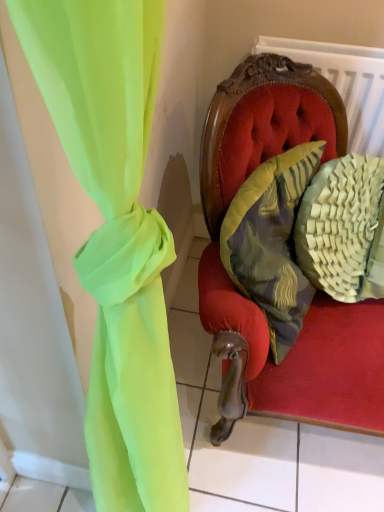
Where is `woven beige pillow at right, which appears as the 1th pillow when viewed from the right`? woven beige pillow at right, which appears as the 1th pillow when viewed from the right is located at coordinates (343, 229).

Describe the element at coordinates (343, 229) in the screenshot. The height and width of the screenshot is (512, 384). I see `woven beige pillow at right, which appears as the 1th pillow when viewed from the right` at that location.

Identify the location of textured yellow pillow at center, the first pillow positioned from the left. The height and width of the screenshot is (512, 384). (271, 242).

Measure the distance between textured yellow pillow at center, the first pillow positioned from the left, and camera.

The depth of textured yellow pillow at center, the first pillow positioned from the left, is 34.22 inches.

This screenshot has width=384, height=512. What do you see at coordinates (271, 242) in the screenshot?
I see `textured yellow pillow at center, placed as the 2th pillow when sorted from right to left` at bounding box center [271, 242].

Where is `woven beige pillow at right, placed as the second pillow when sorted from left to right`? woven beige pillow at right, placed as the second pillow when sorted from left to right is located at coordinates (343, 229).

Is textured yellow pillow at center, the first pillow positioned from the left, to the left of woven beige pillow at right, which appears as the 1th pillow when viewed from the right, from the viewer's perspective?

Yes, textured yellow pillow at center, the first pillow positioned from the left, is to the left of woven beige pillow at right, which appears as the 1th pillow when viewed from the right.

Considering the positions of objects textured yellow pillow at center, the first pillow positioned from the left, and woven beige pillow at right, which appears as the 1th pillow when viewed from the right, in the image provided, who is in front, textured yellow pillow at center, the first pillow positioned from the left, or woven beige pillow at right, which appears as the 1th pillow when viewed from the right,?

textured yellow pillow at center, the first pillow positioned from the left, is closer to the camera.

Is point (271, 198) positioned behind point (310, 215)?

That is False.

From the image's perspective, which object appears higher, textured yellow pillow at center, the first pillow positioned from the left, or woven beige pillow at right, which appears as the 1th pillow when viewed from the right?

From the image's view, woven beige pillow at right, which appears as the 1th pillow when viewed from the right, is above.

From a real-world perspective, which object stands above the other?

textured yellow pillow at center, placed as the 2th pillow when sorted from right to left, from a real-world perspective.

Considering the relative sizes of textured yellow pillow at center, placed as the 2th pillow when sorted from right to left, and woven beige pillow at right, placed as the second pillow when sorted from left to right, in the image provided, is textured yellow pillow at center, placed as the 2th pillow when sorted from right to left, wider than woven beige pillow at right, placed as the second pillow when sorted from left to right,?

No.

From the picture: Between textured yellow pillow at center, the first pillow positioned from the left, and woven beige pillow at right, placed as the second pillow when sorted from left to right, which one has more height?

Standing taller between the two is woven beige pillow at right, placed as the second pillow when sorted from left to right.

Between textured yellow pillow at center, placed as the 2th pillow when sorted from right to left, and woven beige pillow at right, which appears as the 1th pillow when viewed from the right, which one has larger size?

textured yellow pillow at center, placed as the 2th pillow when sorted from right to left.

Is textured yellow pillow at center, the first pillow positioned from the left, positioned beyond the bounds of woven beige pillow at right, which appears as the 1th pillow when viewed from the right?

That's correct, textured yellow pillow at center, the first pillow positioned from the left, is outside of woven beige pillow at right, which appears as the 1th pillow when viewed from the right.

Would you say textured yellow pillow at center, the first pillow positioned from the left, is a long distance from woven beige pillow at right, placed as the second pillow when sorted from left to right?

That's not correct — textured yellow pillow at center, the first pillow positioned from the left, is a little close to woven beige pillow at right, placed as the second pillow when sorted from left to right.

Could you tell me if textured yellow pillow at center, placed as the 2th pillow when sorted from right to left, is turned towards woven beige pillow at right, which appears as the 1th pillow when viewed from the right?

Yes, textured yellow pillow at center, placed as the 2th pillow when sorted from right to left, is facing woven beige pillow at right, which appears as the 1th pillow when viewed from the right.

Measure the distance from textured yellow pillow at center, placed as the 2th pillow when sorted from right to left, to woven beige pillow at right, which appears as the 1th pillow when viewed from the right.

textured yellow pillow at center, placed as the 2th pillow when sorted from right to left, and woven beige pillow at right, which appears as the 1th pillow when viewed from the right, are 5.22 inches apart from each other.

Identify the location of pillow in front of the woven beige pillow at right, placed as the second pillow when sorted from left to right. This screenshot has height=512, width=384. (271, 242).

Does woven beige pillow at right, placed as the second pillow when sorted from left to right, appear on the left side of textured yellow pillow at center, the first pillow positioned from the left?

Incorrect, woven beige pillow at right, placed as the second pillow when sorted from left to right, is not on the left side of textured yellow pillow at center, the first pillow positioned from the left.

Is the depth of woven beige pillow at right, placed as the second pillow when sorted from left to right, less than that of textured yellow pillow at center, placed as the 2th pillow when sorted from right to left?

No.

Considering the positions of point (372, 166) and point (257, 226), is point (372, 166) closer or farther from the camera than point (257, 226)?

Clearly, point (372, 166) is more distant from the camera than point (257, 226).

From the image's perspective, which is above, woven beige pillow at right, placed as the second pillow when sorted from left to right, or textured yellow pillow at center, the first pillow positioned from the left?

woven beige pillow at right, placed as the second pillow when sorted from left to right, is shown above in the image.

From a real-world perspective, between woven beige pillow at right, which appears as the 1th pillow when viewed from the right, and textured yellow pillow at center, the first pillow positioned from the left, who is vertically higher?

textured yellow pillow at center, the first pillow positioned from the left.

Considering the relative sizes of woven beige pillow at right, which appears as the 1th pillow when viewed from the right, and textured yellow pillow at center, placed as the 2th pillow when sorted from right to left, in the image provided, is woven beige pillow at right, which appears as the 1th pillow when viewed from the right, thinner than textured yellow pillow at center, placed as the 2th pillow when sorted from right to left,?

In fact, woven beige pillow at right, which appears as the 1th pillow when viewed from the right, might be wider than textured yellow pillow at center, placed as the 2th pillow when sorted from right to left.

Is woven beige pillow at right, which appears as the 1th pillow when viewed from the right, shorter than textured yellow pillow at center, the first pillow positioned from the left?

No.

Can you confirm if woven beige pillow at right, which appears as the 1th pillow when viewed from the right, is smaller than textured yellow pillow at center, placed as the 2th pillow when sorted from right to left?

Indeed, woven beige pillow at right, which appears as the 1th pillow when viewed from the right, has a smaller size compared to textured yellow pillow at center, placed as the 2th pillow when sorted from right to left.

Is woven beige pillow at right, which appears as the 1th pillow when viewed from the right, located outside textured yellow pillow at center, placed as the 2th pillow when sorted from right to left?

Yes.

Consider the image. Would you consider woven beige pillow at right, placed as the second pillow when sorted from left to right, to be distant from textured yellow pillow at center, the first pillow positioned from the left?

No.

Does woven beige pillow at right, which appears as the 1th pillow when viewed from the right, turn towards textured yellow pillow at center, placed as the 2th pillow when sorted from right to left?

No, woven beige pillow at right, which appears as the 1th pillow when viewed from the right, is not aimed at textured yellow pillow at center, placed as the 2th pillow when sorted from right to left.

At what (x,y) coordinates should I click in order to perform the action: click on pillow on the left of woven beige pillow at right, placed as the second pillow when sorted from left to right. Please return your answer as a coordinate pair (x, y). The height and width of the screenshot is (512, 384). Looking at the image, I should click on (271, 242).

At what (x,y) coordinates should I click in order to perform the action: click on pillow that is below the woven beige pillow at right, which appears as the 1th pillow when viewed from the right (from the image's perspective). Please return your answer as a coordinate pair (x, y). Looking at the image, I should click on (271, 242).

Identify the location of pillow on the left side of woven beige pillow at right, placed as the second pillow when sorted from left to right. The width and height of the screenshot is (384, 512). [x=271, y=242].